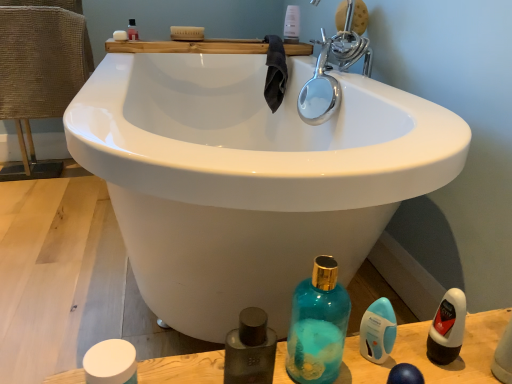
Question: Considering the positions of burlap-textured chair at left and white matte soap at upper left in the image, is burlap-textured chair at left taller or shorter than white matte soap at upper left?

Choices:
 (A) tall
 (B) short

Answer: (A)

Question: Is point (40, 8) closer or farther from the camera than point (126, 34)?

Choices:
 (A) closer
 (B) farther

Answer: (B)

Question: Estimate the real-world distances between objects in this image. Which object is farther from the translucent plastic bottle at upper center, the 1th toiletry from the back?

Choices:
 (A) white matte bottle at lower right, acting as the 3th mouthwash starting from the left
 (B) translucent plastic mouthwash at upper center, marked as the first mouthwash in a left-to-right arrangement
 (C) burlap-textured chair at left
 (D) teal glass bottle at lower center
 (E) dark gray towel at upper center

Answer: (A)

Question: Which object is the closest to the blue translucent pump bottle at lower right, which appears as the second toiletry when viewed from the back?

Choices:
 (A) teal glass bottle at lower center
 (B) white matte jar at lower left, which is counted as the 2th mouthwash, starting from the left
 (C) dark gray towel at upper center
 (D) white matte soap at upper left
 (E) matte black bottle at lower center

Answer: (A)